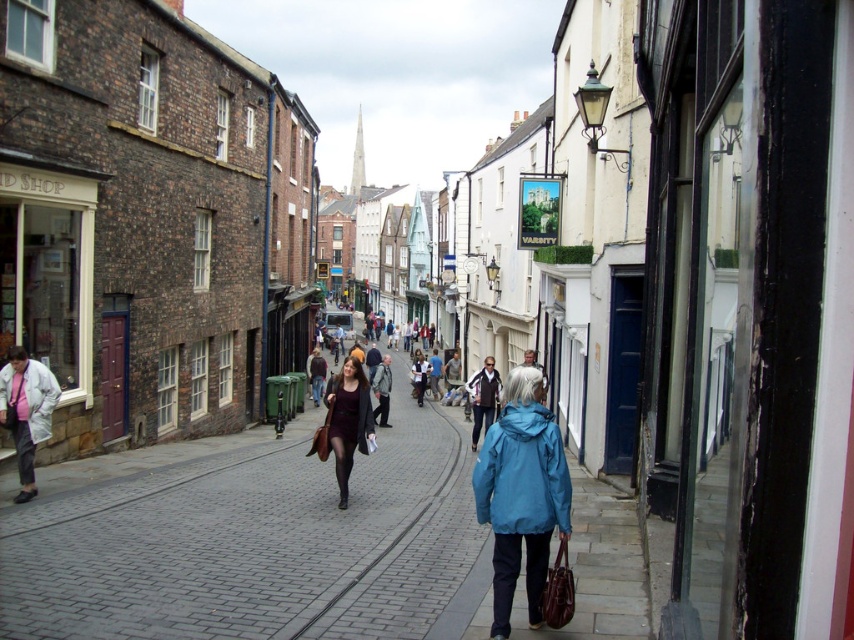
Question: Does matte black coat at center appear on the right side of matte brown jacket at center?

Choices:
 (A) yes
 (B) no

Answer: (B)

Question: Which point appears farthest from the camera in this image?

Choices:
 (A) (336, 436)
 (B) (361, 465)

Answer: (B)

Question: Which point is closer to the camera?

Choices:
 (A) teal matte jacket at center
 (B) matte brown jacket at center
 (C) gray brick pavement at center
 (D) matte black coat at center

Answer: (A)

Question: Is gray brick pavement at center positioned before matte brown jacket at center?

Choices:
 (A) no
 (B) yes

Answer: (B)

Question: Among these points, which one is nearest to the camera?

Choices:
 (A) (509, 577)
 (B) (335, 636)
 (C) (475, 397)

Answer: (A)

Question: From the image, what is the correct spatial relationship of teal matte jacket at center in relation to matte black coat at center?

Choices:
 (A) above
 (B) below

Answer: (A)